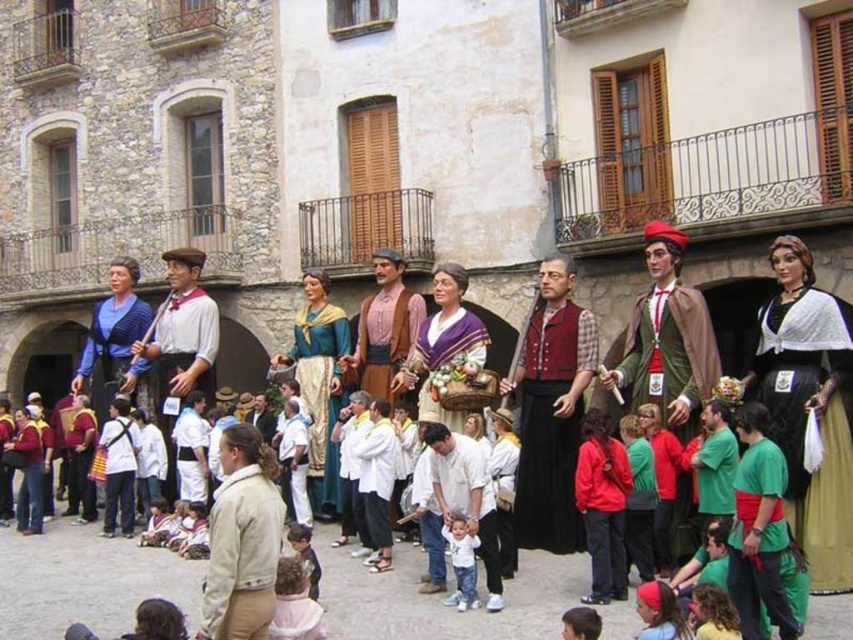
Can you confirm if matte white shirt at center is positioned to the right of rustic brown fabric at center?

Incorrect, matte white shirt at center is not on the right side of rustic brown fabric at center.

Is matte white shirt at center closer to the viewer compared to rustic brown fabric at center?

Yes, it is in front of rustic brown fabric at center.

Does point (173, 403) come closer to viewer compared to point (369, 381)?

No, (173, 403) is behind (369, 381).

Identify the location of matte white shirt at center. (180, 340).

Who is taller, velvet red vest at center or purple velvet basket at center?

velvet red vest at center is taller.

Is the position of velvet red vest at center more distant than that of purple velvet basket at center?

No, it is in front of purple velvet basket at center.

Is point (566, 364) closer to camera compared to point (457, 307)?

That is True.

Locate an element on the screen. velvet red vest at center is located at coordinates (550, 408).

Between black velvet dress at center and beige cotton jacket at center, which one is positioned higher?

→ Positioned higher is black velvet dress at center.

Between black velvet dress at center and beige cotton jacket at center, which one appears on the right side from the viewer's perspective?

Positioned to the right is black velvet dress at center.

Who is more distant from viewer, (845, 448) or (242, 534)?

Point (845, 448)

Locate an element on the screen. This screenshot has height=640, width=853. black velvet dress at center is located at coordinates (805, 420).